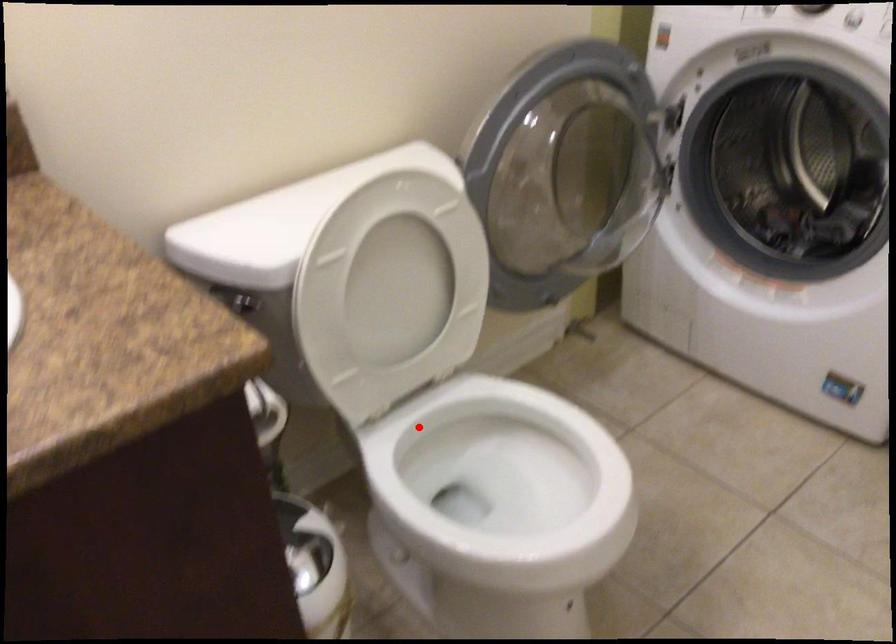
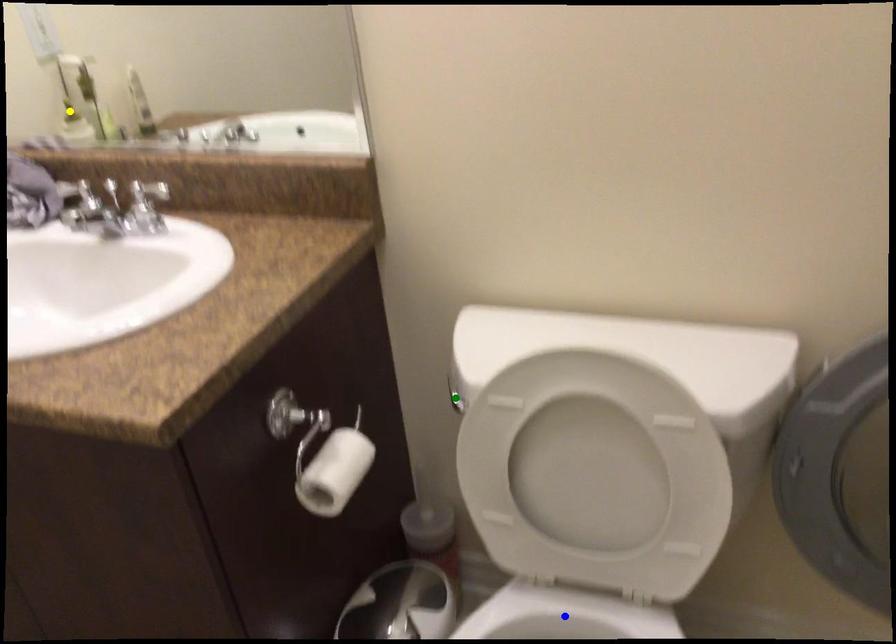
Question: I am providing you with two images of the same scene from different viewpoints. A red point is marked on the first image. You are given multiple points on the second image. Can you choose the point in image 2 that corresponds to the point in image 1?

Choices:
 (A) green point
 (B) blue point
 (C) yellow point

Answer: (B)